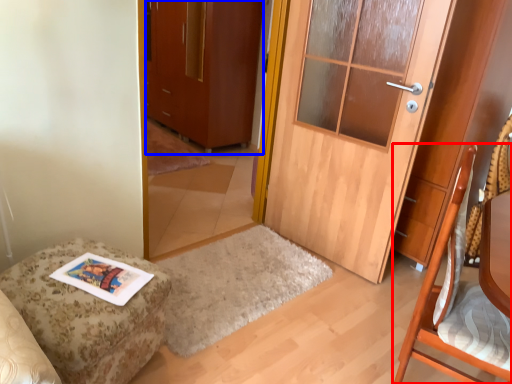
Question: Which object appears farthest to the camera in this image, chair (highlighted by a red box) or cabinetry (highlighted by a blue box)?

Choices:
 (A) chair
 (B) cabinetry

Answer: (B)